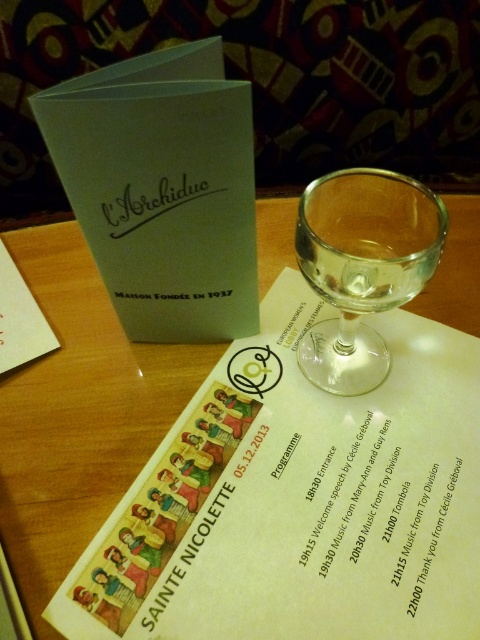
You are at a dinner event and want to grab the clear glass wine at center. To reach it, you need to move around the wooden table at center. Is the wine glass behind or in front of the table?

The clear glass wine at center is behind wooden table at center, so you need to move around the table to reach it.

You are setting up a dinner table and have a decorative plate that is 6 inches in diameter. You want to place it between the wooden table at center and the transparent glass wine glass at center. Will there be enough space between them to fit the plate?

The wooden table at center and the transparent glass wine glass at center are 6.28 inches apart. Since the plate is 6 inches in diameter, there is enough space to fit it between them.

You are setting up a table for an event and need to place the transparent glass wine glass at center on the wooden table at center. Can you place the glass directly on the table?

The wooden table at center is positioned over the transparent glass wine glass at center, so the glass is already placed on the table.